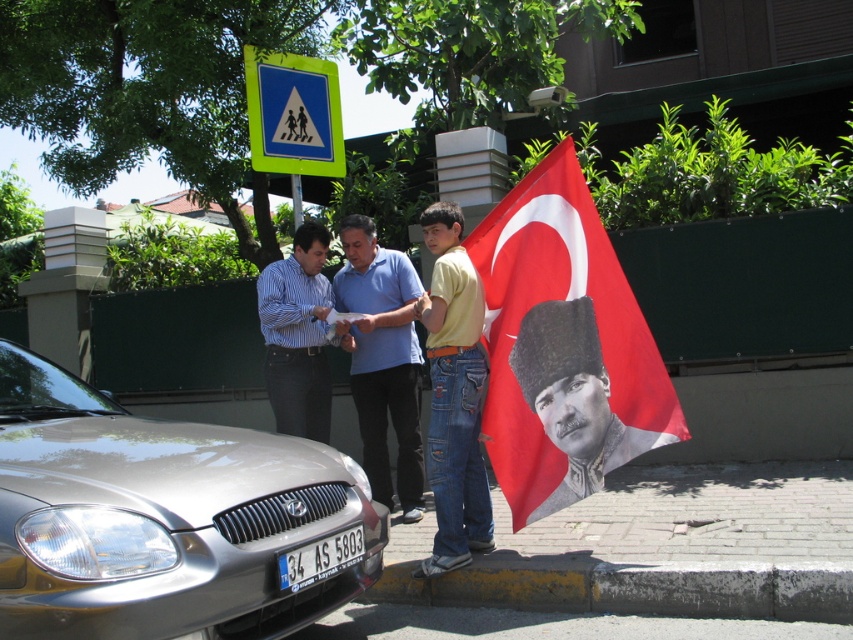
You are a delivery person needing to place a package between the satin silver car at lower left and the black textured portrait at center. The package requires 6 feet of space. Is there enough space?

The distance between the satin silver car at lower left and the black textured portrait at center is 5.34 feet, which is less than the required 6 feet. Therefore, there isn not enough space to place the package between them.

You are a photographer trying to capture a photo of the black textured portrait at center while avoiding the satin silver car at lower left. Since the car is lower than the portrait, can you position yourself so that the car doesn

The satin silver car at lower left is not as tall as the black textured portrait at center, so if you position yourself at a higher angle, the car will be partially hidden behind the base of the portrait, allowing you to capture the portrait without the car obstructing it.

You are a photographer trying to capture a photo of the satin silver car at lower left and the black textured portrait at center. Since you want both subjects to be clearly visible in the frame, which subject should you focus on first to ensure proper focus?

The satin silver car at lower left should be focused on first because it is larger in size compared to the black textured portrait at center, making it more prominent and requiring clearer focus.